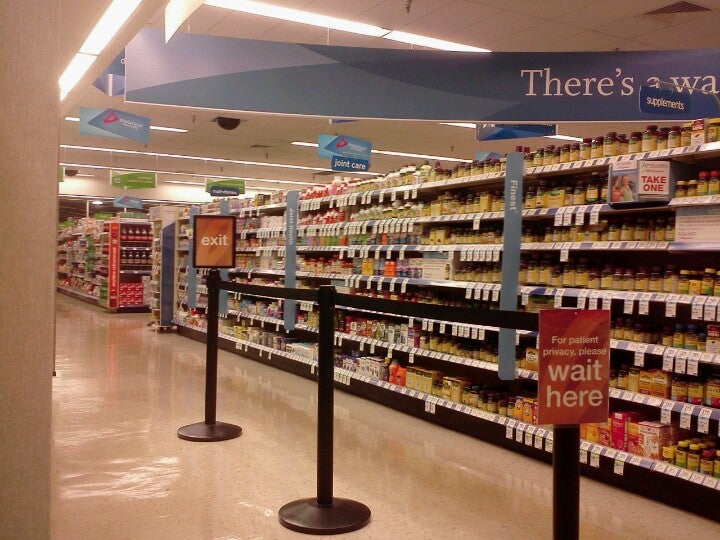
Find the location of a particular element. The width and height of the screenshot is (720, 540). shelves is located at coordinates (456, 418), (454, 366), (461, 333), (464, 284), (464, 245), (462, 170), (466, 225).